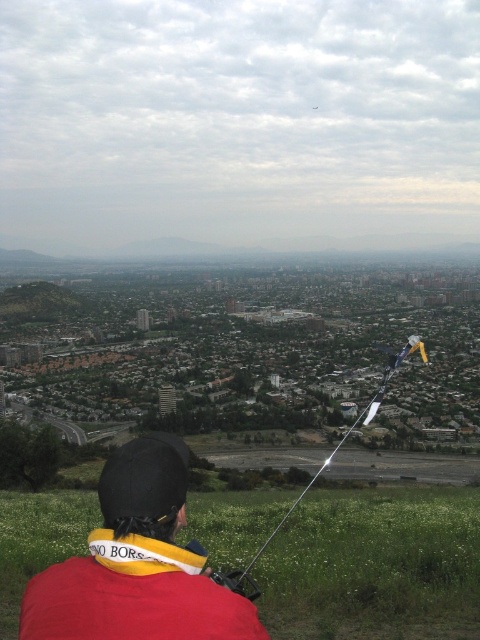
Is green grassy field at lower center in front of metallic silver string at lower center?

Yes.

Can you confirm if green grassy field at lower center is positioned to the right of metallic silver string at lower center?

No, green grassy field at lower center is not to the right of metallic silver string at lower center.

Locate an element on the screen. The height and width of the screenshot is (640, 480). green grassy field at lower center is located at coordinates (374, 564).

The image size is (480, 640). What do you see at coordinates (137, 563) in the screenshot?
I see `red fabric jacket at lower center` at bounding box center [137, 563].

Between point (214, 637) and point (374, 412), which one is positioned behind?

The point (374, 412) is behind.

This screenshot has height=640, width=480. What do you see at coordinates (137, 563) in the screenshot?
I see `red fabric jacket at lower center` at bounding box center [137, 563].

Where is `red fabric jacket at lower center`? red fabric jacket at lower center is located at coordinates click(137, 563).

Between green grassy field at lower center and red fabric jacket at lower center, which one appears on the left side from the viewer's perspective?

From the viewer's perspective, red fabric jacket at lower center appears more on the left side.

Which is behind, point (411, 515) or point (165, 608)?

The point (411, 515) is more distant.

Is point (423, 628) more distant than point (126, 620)?

That is True.

Where is `green grassy field at lower center`? The image size is (480, 640). green grassy field at lower center is located at coordinates (374, 564).